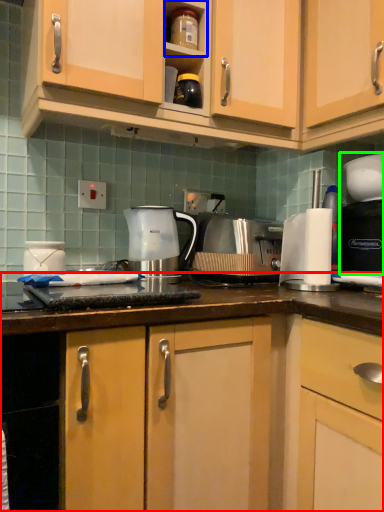
Question: Which object is positioned closest to countertop (highlighted by a red box)? Select from shelf (highlighted by a blue box) and coffee machine (highlighted by a green box).

Choices:
 (A) shelf
 (B) coffee machine

Answer: (B)